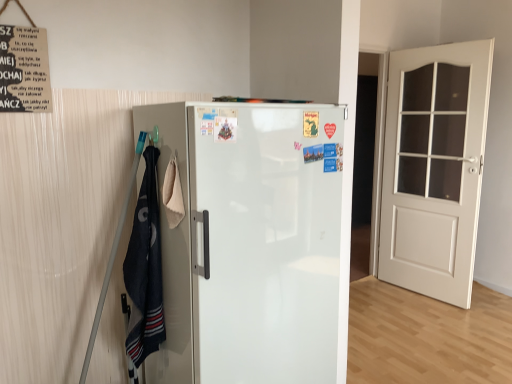
Question: From the image's perspective, is white wood door at right positioned above or below white glossy refrigerator at center?

Choices:
 (A) above
 (B) below

Answer: (A)

Question: Considering the positions of point (441, 187) and point (325, 157), is point (441, 187) closer or farther from the camera than point (325, 157)?

Choices:
 (A) closer
 (B) farther

Answer: (B)

Question: Which is nearer to the white wood door at right?

Choices:
 (A) dark blue cotton towel at left
 (B) white glossy refrigerator at center
 (C) black paper poster at upper left

Answer: (B)

Question: Based on their relative distances, which object is nearer to the black paper poster at upper left?

Choices:
 (A) white wood door at right
 (B) white glossy refrigerator at center
 (C) dark blue cotton towel at left

Answer: (C)